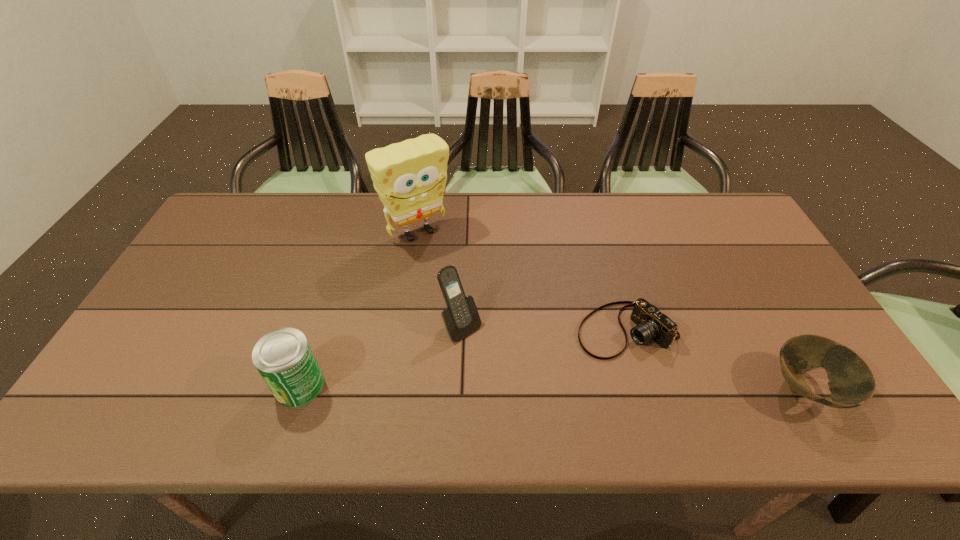
Find the location of a particular element. This screenshot has height=540, width=960. the third shortest object is located at coordinates (283, 357).

The image size is (960, 540). Identify the location of can. (283, 357).

You are a GUI agent. You are given a task and a screenshot of the screen. Output one action in this format:
    pyautogui.click(x=<x>, y=<y>)
    Task: Click on the fourth tallest object
    This screenshot has width=960, height=540.
    Given the screenshot: What is the action you would take?
    pyautogui.click(x=851, y=382)

Locate an element on the screen. The height and width of the screenshot is (540, 960). the rightmost object is located at coordinates (851, 382).

The image size is (960, 540). I want to click on sponge, so click(410, 177).

The width and height of the screenshot is (960, 540). What are the coordinates of `the farthest object` in the screenshot? It's located at (410, 177).

This screenshot has width=960, height=540. In order to click on cellular telephone in this screenshot , I will do `click(461, 318)`.

Find the location of a particular element. The width and height of the screenshot is (960, 540). the second object from right to left is located at coordinates (651, 324).

You are a GUI agent. You are given a task and a screenshot of the screen. Output one action in this format:
    pyautogui.click(x=<x>, y=<y>)
    Task: Click on the camera
    The width and height of the screenshot is (960, 540).
    Given the screenshot: What is the action you would take?
    pyautogui.click(x=651, y=324)

I want to click on vacant space situated on the left of the third shortest object, so click(108, 384).